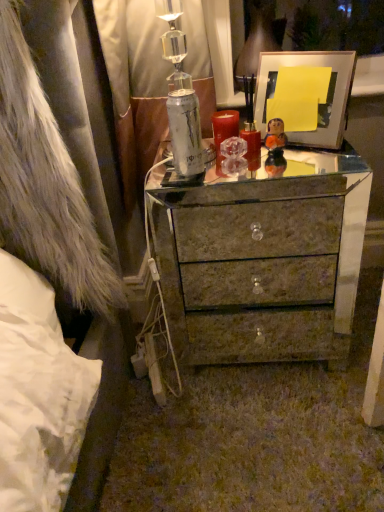
Question: Would you say matte white picture frame at upper right is a long distance from marble-like drawer at center?

Choices:
 (A) yes
 (B) no

Answer: (B)

Question: Can marble-like drawer at center be found inside matte white picture frame at upper right?

Choices:
 (A) yes
 (B) no

Answer: (B)

Question: Can you confirm if matte white picture frame at upper right is wider than marble-like drawer at center?

Choices:
 (A) yes
 (B) no

Answer: (A)

Question: From the image's perspective, is matte white picture frame at upper right on marble-like drawer at center?

Choices:
 (A) no
 (B) yes

Answer: (B)

Question: Considering the relative positions of matte white picture frame at upper right and marble-like drawer at center in the image provided, is matte white picture frame at upper right to the left of marble-like drawer at center from the viewer's perspective?

Choices:
 (A) no
 (B) yes

Answer: (B)

Question: From the image's perspective, relative to fuzzy white fur coat at left, is matte white picture frame at upper right above or below?

Choices:
 (A) below
 (B) above

Answer: (B)

Question: Would you say matte white picture frame at upper right is to the left or to the right of fuzzy white fur coat at left in the picture?

Choices:
 (A) left
 (B) right

Answer: (B)

Question: Which is correct: matte white picture frame at upper right is inside fuzzy white fur coat at left, or outside of it?

Choices:
 (A) inside
 (B) outside

Answer: (B)

Question: Relative to fuzzy white fur coat at left, is matte white picture frame at upper right in front or behind?

Choices:
 (A) front
 (B) behind

Answer: (B)

Question: From a real-world perspective, is shiny metallic chest of drawers at center above or below marble-like drawer at center?

Choices:
 (A) below
 (B) above

Answer: (B)

Question: Is shiny metallic chest of drawers at center situated inside marble-like drawer at center or outside?

Choices:
 (A) outside
 (B) inside

Answer: (A)

Question: Considering the positions of point (243, 205) and point (264, 227), is point (243, 205) closer or farther from the camera than point (264, 227)?

Choices:
 (A) farther
 (B) closer

Answer: (B)

Question: In terms of size, does shiny metallic chest of drawers at center appear bigger or smaller than marble-like drawer at center?

Choices:
 (A) small
 (B) big

Answer: (B)

Question: In the image, is marble-like drawer at center positioned in front of or behind shiny metallic chest of drawers at center?

Choices:
 (A) behind
 (B) front

Answer: (A)

Question: In the image, is marble-like drawer at center on the left side or the right side of shiny metallic chest of drawers at center?

Choices:
 (A) left
 (B) right

Answer: (B)